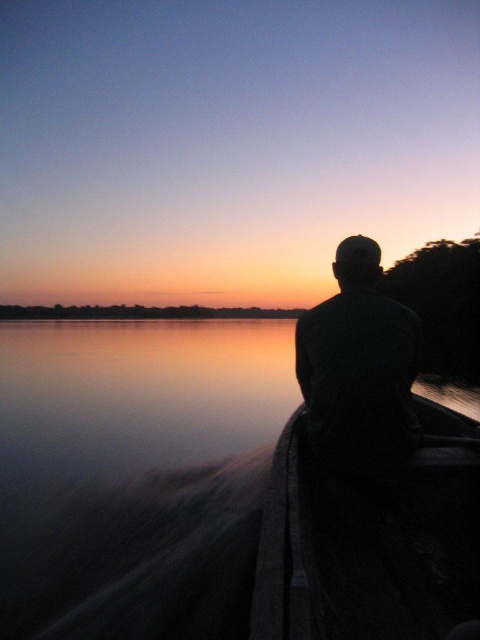
You are standing on the dock and want to place a 24 inch long fishing rod between the dark wood canoe at right and the dark green fabric at center. Can you fit it between them without bending the rod?

The dark wood canoe at right is 24.65 inches from the dark green fabric at center. Since the fishing rod is 24 inches long, it can fit between them as the distance is slightly longer than the rod.

You are standing on the shore observing the sunset scene. You notice the smooth water at boat right and the dark green fabric at center. Which object is nearer to you?

The smooth water at boat right is closer to the viewer than the dark green fabric at center.

You are a photographer trying to capture the reflection of the sunset in the smooth water at boat right. Based on the coordinates provided, where should you position your camera to ensure the reflection is centered in your shot?

The smooth water at boat right is located at coordinates point (x=205, y=499), so you should position your camera directly above or aligned with this point to center the reflection in your shot.